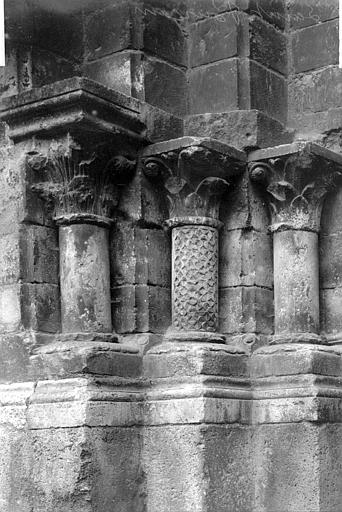
This screenshot has height=512, width=342. I want to click on textured columns, so click(202, 280).